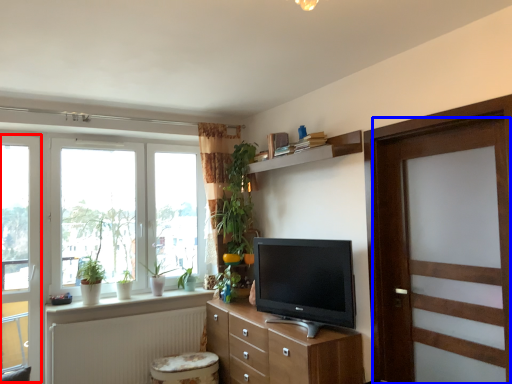
Question: Among these objects, which one is farthest to the camera, glass door (highlighted by a red box) or door (highlighted by a blue box)?

Choices:
 (A) glass door
 (B) door

Answer: (A)